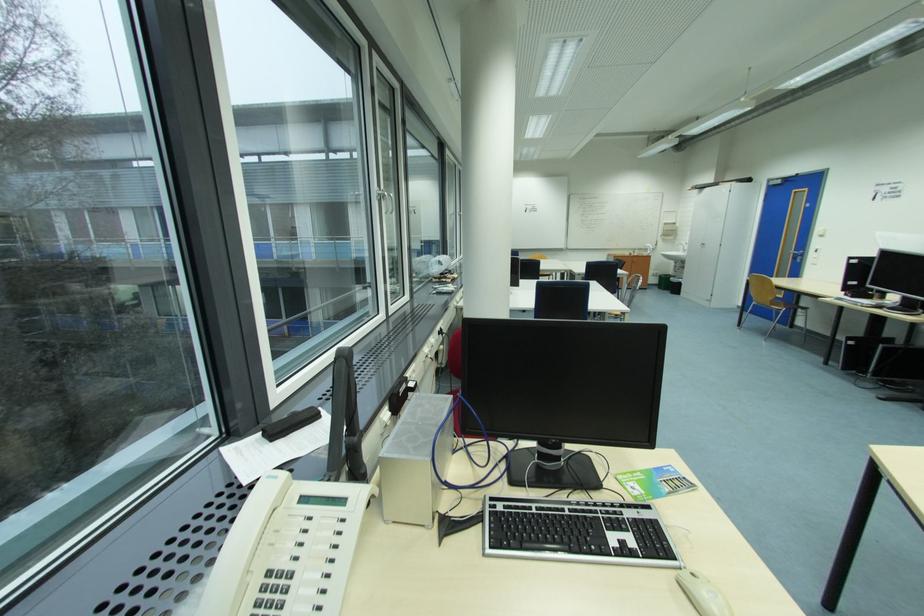
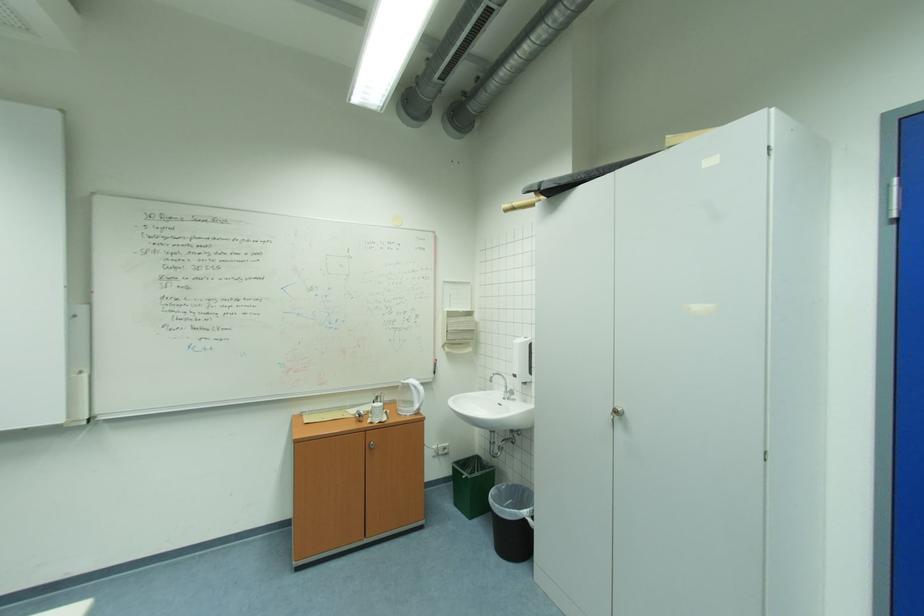
Question: I am providing you with two images of the same scene from different viewpoints. Which of the following objects are not visible in image2?

Choices:
 (A) white soap dispenser
 (B) silver cabinet knob
 (C) white electric kettle
 (D) none of these

Answer: (D)